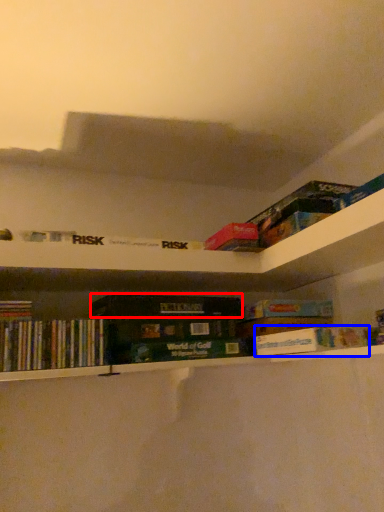
Question: Which object appears farthest to the camera in this image, paperback book (highlighted by a red box) or book (highlighted by a blue box)?

Choices:
 (A) paperback book
 (B) book

Answer: (A)